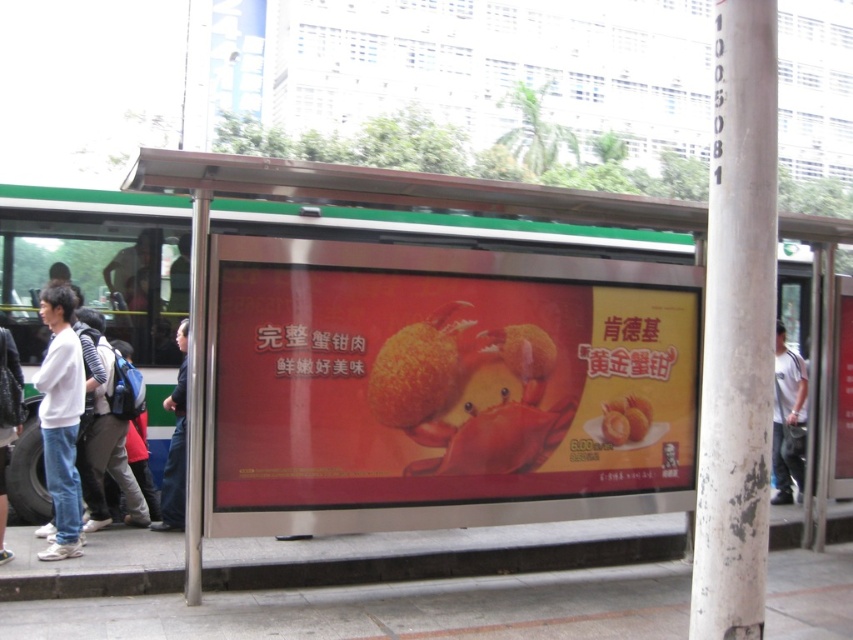
Question: Which point is farther to the camera?

Choices:
 (A) (454, 362)
 (B) (148, 524)
 (C) (177, 442)
 (D) (76, 435)

Answer: (B)

Question: Does white cotton shirt at left appear over blue backpack at left?

Choices:
 (A) no
 (B) yes

Answer: (B)

Question: Estimate the real-world distances between objects in this image. Which object is farther from the white cotton shirt at right?

Choices:
 (A) white cotton shirt at left
 (B) denim jeans at left
 (C) white matte shirt at left

Answer: (A)

Question: In this image, where is red glossy poster at center located relative to white cotton shirt at left?

Choices:
 (A) left
 (B) right

Answer: (B)

Question: Does white matte shirt at left appear on the left side of denim jeans at left?

Choices:
 (A) no
 (B) yes

Answer: (A)

Question: Which object is closer to the camera taking this photo?

Choices:
 (A) white cotton shirt at right
 (B) dark blue jeans at lower left
 (C) white matte shirt at left

Answer: (C)